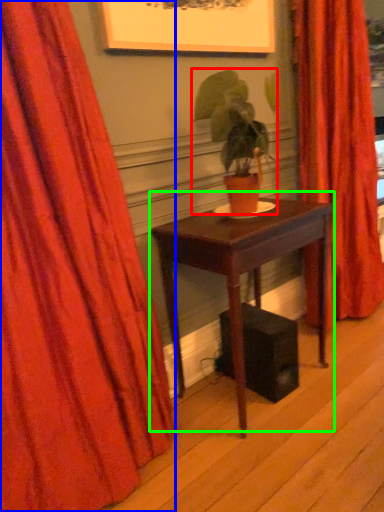
Question: Which object is positioned closest to houseplant (highlighted by a red box)? Select from curtain (highlighted by a blue box) and table (highlighted by a green box).

Choices:
 (A) curtain
 (B) table

Answer: (B)